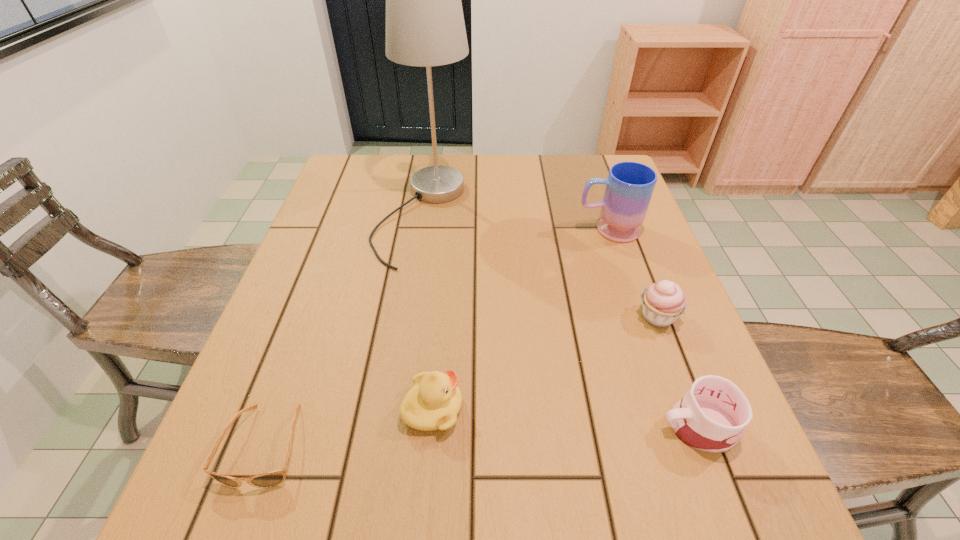
Where is `free space between the sunglasses and the shorter mug`? The width and height of the screenshot is (960, 540). free space between the sunglasses and the shorter mug is located at coordinates (482, 436).

Find the location of a particular element. free point between the third farthest object and the tallest object is located at coordinates (540, 266).

The image size is (960, 540). I want to click on unoccupied area between the nearer mug and the third farthest object, so click(x=678, y=371).

Identify the location of blank region between the cupcake and the table lamp. (540, 266).

Where is `vacant area that lies between the duckling and the leftmost object`? The image size is (960, 540). vacant area that lies between the duckling and the leftmost object is located at coordinates (349, 427).

This screenshot has height=540, width=960. Identify the location of unoccupied position between the fifth shortest object and the shortest object. (437, 338).

In order to click on vacant space that is in between the nearer mug and the cupcake in this screenshot , I will do [678, 371].

This screenshot has width=960, height=540. Identify the location of empty space between the sunglasses and the cupcake. (462, 381).

Identify the location of the third closest object relative to the farther mug. The height and width of the screenshot is (540, 960). (711, 417).

Select which object appears as the fifth closest to the duckling. Please provide its 2D coordinates. Your answer should be formatted as a tuple, i.e. [(x, y)], where the tuple contains the x and y coordinates of a point satisfying the conditions above.

[(629, 187)]